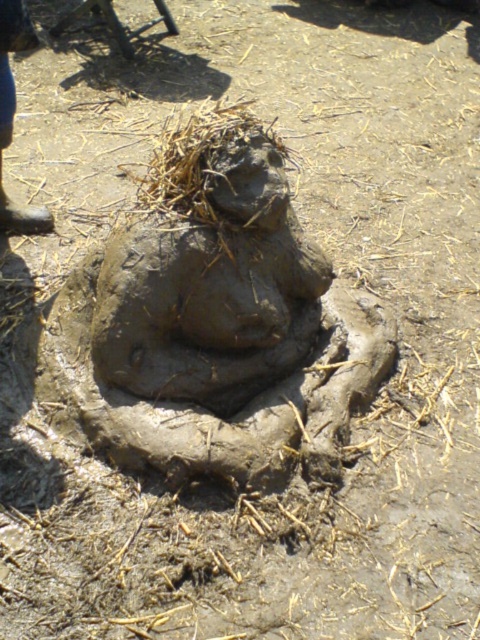
Question: Which object is closer to the camera taking this photo?

Choices:
 (A) clay figure at center
 (B) blue jeans at left

Answer: (A)

Question: Which of the following is the farthest from the observer?

Choices:
 (A) blue jeans at left
 (B) clay figure at center

Answer: (A)

Question: Is clay figure at center wider than blue jeans at left?

Choices:
 (A) no
 (B) yes

Answer: (B)

Question: Which point is closer to the camera taking this photo?

Choices:
 (A) (294, 237)
 (B) (22, 4)

Answer: (B)

Question: Can you confirm if clay figure at center is positioned to the right of blue jeans at left?

Choices:
 (A) no
 (B) yes

Answer: (B)

Question: In this image, where is clay figure at center located relative to blue jeans at left?

Choices:
 (A) left
 (B) right

Answer: (B)